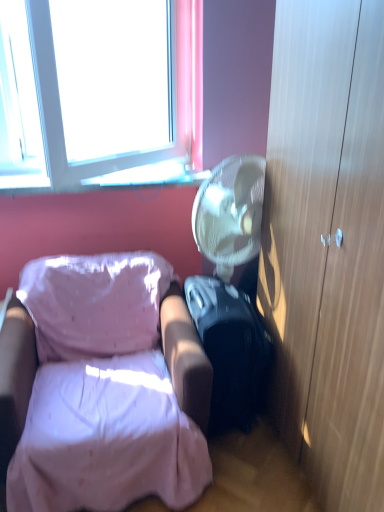
What do you see at coordinates (151, 176) in the screenshot?
I see `transparent glass window sill at upper left` at bounding box center [151, 176].

Where is `transparent glass window sill at upper left`? The height and width of the screenshot is (512, 384). transparent glass window sill at upper left is located at coordinates (151, 176).

Would you say pink fabric chair at lower left is outside wooden cabinet at right?

Indeed, pink fabric chair at lower left is completely outside wooden cabinet at right.

In the scene shown: Is wooden cabinet at right at the back of pink fabric chair at lower left?

No, pink fabric chair at lower left is not facing the opposite direction of wooden cabinet at right.

From the image's perspective, is pink fabric chair at lower left beneath wooden cabinet at right?

Yes.

Considering the relative positions of pink fabric chair at lower left and wooden cabinet at right in the image provided, is pink fabric chair at lower left to the right of wooden cabinet at right from the viewer's perspective?

No, pink fabric chair at lower left is not to the right of wooden cabinet at right.

Between point (219, 367) and point (66, 266), which one is positioned behind?

The point (66, 266) is farther from the camera.

From the image's perspective, between black matte suitcase at lower right and pink fabric chair at lower left, which one is located above?

black matte suitcase at lower right appears higher in the image.

Considering their positions, is black matte suitcase at lower right located in front of or behind pink fabric chair at lower left?

Visually, black matte suitcase at lower right is located behind pink fabric chair at lower left.

Is black matte suitcase at lower right bigger than pink fabric chair at lower left?

No, black matte suitcase at lower right is not bigger than pink fabric chair at lower left.

Based on the photo, considering the sizes of pink fabric chair at lower left and black matte suitcase at lower right in the image, is pink fabric chair at lower left bigger or smaller than black matte suitcase at lower right?

Considering their sizes, pink fabric chair at lower left takes up more space than black matte suitcase at lower right.

Considering the sizes of objects pink fabric chair at lower left and black matte suitcase at lower right in the image provided, who is wider, pink fabric chair at lower left or black matte suitcase at lower right?

With larger width is pink fabric chair at lower left.

Can you tell me how much pink fabric chair at lower left and black matte suitcase at lower right differ in facing direction?

pink fabric chair at lower left and black matte suitcase at lower right are facing 94.3 degrees away from each other.

Does point (170, 458) lie in front of point (216, 379)?

Yes, it is in front of point (216, 379).

Consider the image. Who is bigger, black matte suitcase at lower right or transparent glass window sill at upper left?

Bigger between the two is black matte suitcase at lower right.

Between black matte suitcase at lower right and transparent glass window sill at upper left, which one has larger width?

With larger width is black matte suitcase at lower right.

Is black matte suitcase at lower right inside or outside of transparent glass window sill at upper left?

black matte suitcase at lower right is not inside transparent glass window sill at upper left, it's outside.

How distant is black matte suitcase at lower right from transparent glass window sill at upper left?

The distance of black matte suitcase at lower right from transparent glass window sill at upper left is 30.09 inches.

Between point (65, 304) and point (128, 170), which one is positioned behind?

The point (128, 170) is farther from the camera.

Is pink fabric chair at lower left to the left of transparent glass window sill at upper left from the viewer's perspective?

No, pink fabric chair at lower left is not to the left of transparent glass window sill at upper left.

Are pink fabric chair at lower left and transparent glass window sill at upper left located far from each other?

pink fabric chair at lower left is actually quite close to transparent glass window sill at upper left.

From a real-world perspective, which object stands above the other?

In real-world perspective, transparent glass window sill at upper left is above.

Can you tell me how much wooden cabinet at right and pink fabric chair at lower left differ in facing direction?

The facing directions of wooden cabinet at right and pink fabric chair at lower left are 87.2 degrees apart.

Could you tell me if wooden cabinet at right is turned towards pink fabric chair at lower left?

Yes.

Which of these two, wooden cabinet at right or pink fabric chair at lower left, is smaller?

pink fabric chair at lower left.

Is wooden cabinet at right in contact with pink fabric chair at lower left?

No, wooden cabinet at right is not making contact with pink fabric chair at lower left.

Are transparent glass window sill at upper left and pink fabric chair at lower left beside each other?

No, transparent glass window sill at upper left is not making contact with pink fabric chair at lower left.

Between point (139, 173) and point (31, 265), which one is positioned in front?

Positioned in front is point (31, 265).

Looking at this image, from a real-world perspective, is transparent glass window sill at upper left positioned over pink fabric chair at lower left based on gravity?

Yes, from a real-world perspective, transparent glass window sill at upper left is on top of pink fabric chair at lower left.

Which object is wider, transparent glass window sill at upper left or pink fabric chair at lower left?

pink fabric chair at lower left is wider.

Where is `cabinetry in front of the pink fabric chair at lower left`? Image resolution: width=384 pixels, height=512 pixels. cabinetry in front of the pink fabric chair at lower left is located at coordinates (327, 246).

The height and width of the screenshot is (512, 384). I want to click on chair below the black matte suitcase at lower right (from the image's perspective), so click(x=99, y=390).

Estimate the real-world distances between objects in this image. Which object is further from transparent glass window sill at upper left, wooden cabinet at right or pink fabric chair at lower left?

wooden cabinet at right is further to transparent glass window sill at upper left.

Looking at the image, which one is located closer to pink fabric chair at lower left, black matte suitcase at lower right or wooden cabinet at right?

black matte suitcase at lower right.

When comparing their distances from pink fabric chair at lower left, does wooden cabinet at right or transparent glass window sill at upper left seem further?

Among the two, transparent glass window sill at upper left is located further to pink fabric chair at lower left.

Which object lies further to the anchor point pink fabric chair at lower left, black matte suitcase at lower right or transparent glass window sill at upper left?

transparent glass window sill at upper left is positioned further to the anchor pink fabric chair at lower left.

When comparing their distances from black matte suitcase at lower right, does transparent glass window sill at upper left or wooden cabinet at right seem closer?

wooden cabinet at right is closer to black matte suitcase at lower right.

From the image, which object appears to be nearer to wooden cabinet at right, pink fabric chair at lower left or transparent glass window sill at upper left?

pink fabric chair at lower left lies closer to wooden cabinet at right than the other object.

Considering their positions, is pink fabric chair at lower left positioned closer to wooden cabinet at right than black matte suitcase at lower right?

The object closer to wooden cabinet at right is black matte suitcase at lower right.

Based on their spatial positions, is transparent glass window sill at upper left or pink fabric chair at lower left closer to wooden cabinet at right?

pink fabric chair at lower left lies closer to wooden cabinet at right than the other object.

Identify the location of chair between wooden cabinet at right and transparent glass window sill at upper left in the front-back direction. Image resolution: width=384 pixels, height=512 pixels. (99, 390).

The image size is (384, 512). What are the coordinates of `suitcase between pink fabric chair at lower left and wooden cabinet at right` in the screenshot? It's located at (230, 351).

This screenshot has width=384, height=512. Identify the location of suitcase positioned between wooden cabinet at right and transparent glass window sill at upper left from near to far. (230, 351).

In order to click on suitcase that lies between transparent glass window sill at upper left and pink fabric chair at lower left from top to bottom in this screenshot , I will do `click(230, 351)`.